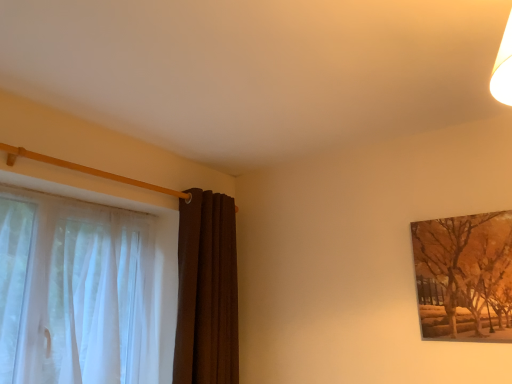
Question: From a real-world perspective, is sheer white curtain at left, positioned as the first curtain in left-to-right order, on top of brown velvet curtain at left, positioned as the 2th curtain in left-to-right order?

Choices:
 (A) no
 (B) yes

Answer: (A)

Question: Is sheer white curtain at left, positioned as the first curtain in left-to-right order, turned away from brown velvet curtain at left, positioned as the 2th curtain in left-to-right order?

Choices:
 (A) yes
 (B) no

Answer: (B)

Question: From a real-world perspective, does sheer white curtain at left, positioned as the first curtain in left-to-right order, sit lower than brown velvet curtain at left, positioned as the 2th curtain in left-to-right order?

Choices:
 (A) yes
 (B) no

Answer: (A)

Question: Does sheer white curtain at left, the second curtain when ordered from right to left, have a greater width compared to brown velvet curtain at left, the first curtain positioned from the right?

Choices:
 (A) yes
 (B) no

Answer: (A)

Question: Does sheer white curtain at left, the second curtain when ordered from right to left, have a larger size compared to brown velvet curtain at left, positioned as the 2th curtain in left-to-right order?

Choices:
 (A) no
 (B) yes

Answer: (B)

Question: Is sheer white curtain at left, the second curtain when ordered from right to left, outside brown velvet curtain at left, the first curtain positioned from the right?

Choices:
 (A) no
 (B) yes

Answer: (B)

Question: Is there a large distance between brown textured painting at upper right and brown velvet curtain at left, the first curtain positioned from the right?

Choices:
 (A) yes
 (B) no

Answer: (A)

Question: Is brown textured painting at upper right outside of brown velvet curtain at left, the first curtain positioned from the right?

Choices:
 (A) yes
 (B) no

Answer: (A)

Question: Is brown textured painting at upper right taller than brown velvet curtain at left, positioned as the 2th curtain in left-to-right order?

Choices:
 (A) yes
 (B) no

Answer: (B)

Question: From the image's perspective, is brown textured painting at upper right under brown velvet curtain at left, the first curtain positioned from the right?

Choices:
 (A) no
 (B) yes

Answer: (A)

Question: Is brown textured painting at upper right in contact with brown velvet curtain at left, positioned as the 2th curtain in left-to-right order?

Choices:
 (A) no
 (B) yes

Answer: (A)

Question: Can you confirm if brown textured painting at upper right is thinner than brown velvet curtain at left, positioned as the 2th curtain in left-to-right order?

Choices:
 (A) no
 (B) yes

Answer: (B)

Question: Considering the relative positions of brown velvet curtain at left, positioned as the 2th curtain in left-to-right order, and brown textured painting at upper right in the image provided, is brown velvet curtain at left, positioned as the 2th curtain in left-to-right order, to the right of brown textured painting at upper right from the viewer's perspective?

Choices:
 (A) no
 (B) yes

Answer: (A)